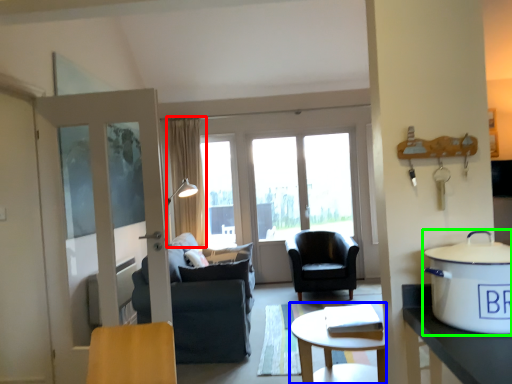
Question: Which is nearer to the curtain (highlighted by a red box)? coffee table (highlighted by a blue box) or cooker (highlighted by a green box).

Choices:
 (A) coffee table
 (B) cooker

Answer: (A)